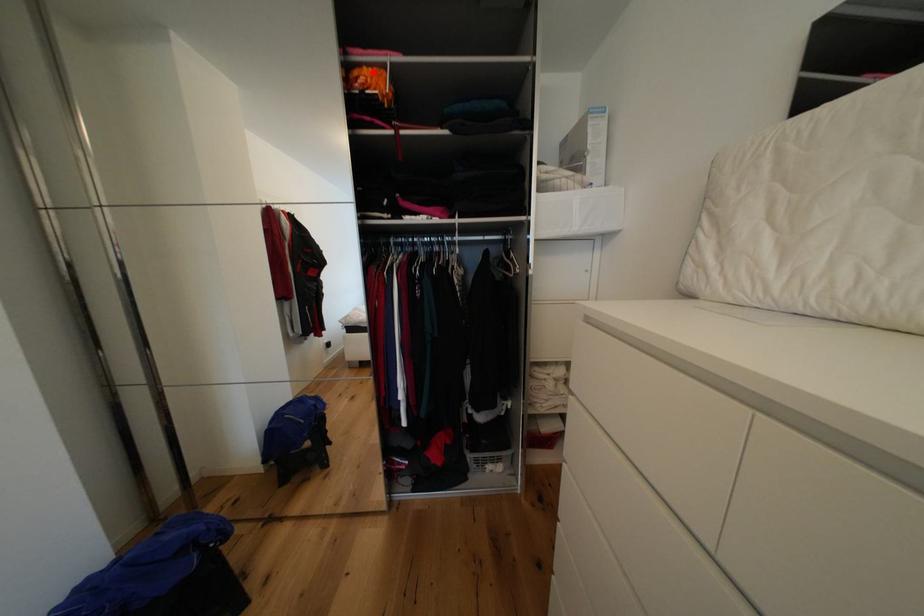
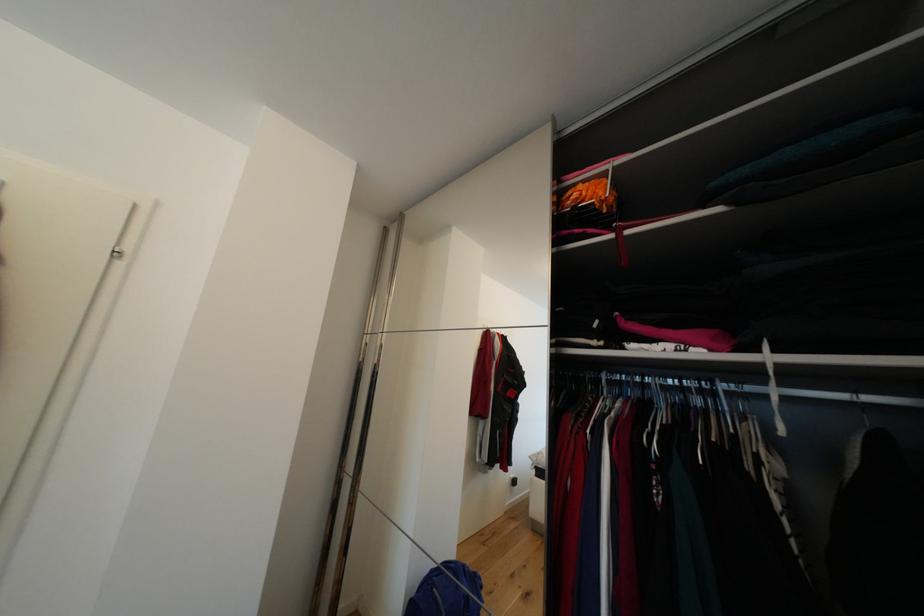
Where in the second image is the point corresponding to the highlighted location from the first image?

(588, 188)